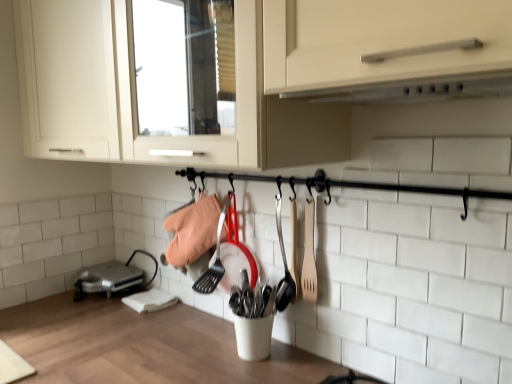
Describe the element at coordinates (284, 267) in the screenshot. I see `wooden spoon at center-right` at that location.

Measure the distance between wooden spoon at center-right and camera.

1.22 meters.

Locate an element on the screen. The width and height of the screenshot is (512, 384). white wood countertop at center is located at coordinates (142, 346).

Measure the distance between white wood countertop at center and camera.

white wood countertop at center and camera are 1.07 meters apart from each other.

Where is `white matte exhaust hood at upper center`? white matte exhaust hood at upper center is located at coordinates (414, 88).

The height and width of the screenshot is (384, 512). In order to click on wooden spoon at center-right in this screenshot , I will do `click(284, 267)`.

Considering the sizes of white matte exhaust hood at upper center and wooden spoon at center-right in the image, is white matte exhaust hood at upper center wider or thinner than wooden spoon at center-right?

In the image, white matte exhaust hood at upper center appears to be wider than wooden spoon at center-right.

Is wooden spoon at center-right a part of white matte exhaust hood at upper center?

No, wooden spoon at center-right is not surrounded by white matte exhaust hood at upper center.

Considering the relative sizes of white matte exhaust hood at upper center and wooden spoon at center-right in the image provided, is white matte exhaust hood at upper center taller than wooden spoon at center-right?

In fact, white matte exhaust hood at upper center may be shorter than wooden spoon at center-right.

In terms of height, does silver metallic toaster at lower left look taller or shorter compared to wooden spatula at center-right?

Considering their sizes, silver metallic toaster at lower left has less height than wooden spatula at center-right.

Is silver metallic toaster at lower left far from wooden spatula at center-right?

That's not correct — silver metallic toaster at lower left is a little close to wooden spatula at center-right.

How far apart are silver metallic toaster at lower left and wooden spatula at center-right?

The distance of silver metallic toaster at lower left from wooden spatula at center-right is 34.22 inches.

In the image, is silver metallic toaster at lower left on the left side or the right side of wooden spatula at center-right?

In the image, silver metallic toaster at lower left appears on the left side of wooden spatula at center-right.

Measure the distance from wooden spatula at center-right to silver metallic toaster at lower left.

A distance of 34.22 inches exists between wooden spatula at center-right and silver metallic toaster at lower left.

Is wooden spatula at center-right turned away from silver metallic toaster at lower left?

No, wooden spatula at center-right's orientation is not away from silver metallic toaster at lower left.

From the image's perspective, which object appears higher, wooden spatula at center-right or silver metallic toaster at lower left?

wooden spatula at center-right.

Considering the relative positions of wooden spatula at center-right and silver metallic toaster at lower left in the image provided, is wooden spatula at center-right to the left or to the right of silver metallic toaster at lower left?

wooden spatula at center-right is to the right of silver metallic toaster at lower left.

Considering the relative positions of wooden spoon at center-right and white matte exhaust hood at upper center in the image provided, is wooden spoon at center-right to the right of white matte exhaust hood at upper center from the viewer's perspective?

Incorrect, wooden spoon at center-right is not on the right side of white matte exhaust hood at upper center.

Is wooden spoon at center-right situated inside white matte exhaust hood at upper center or outside?

The correct answer is: outside.

Is point (288, 270) closer to viewer compared to point (411, 82)?

No.

Which of these two, white wood countertop at center or wooden spatula at center-right, stands taller?

With more height is white wood countertop at center.

From a real-world perspective, which object stands above the other?

wooden spatula at center-right.

Does white wood countertop at center appear on the left side of wooden spatula at center-right?

Indeed, white wood countertop at center is positioned on the left side of wooden spatula at center-right.

How different are the orientations of white wood countertop at center and wooden spatula at center-right in degrees?

The angle between the facing direction of white wood countertop at center and the facing direction of wooden spatula at center-right is 0.742 degrees.

Can you tell me how much silver metallic toaster at lower left and white wood countertop at center differ in facing direction?

The angle between the facing direction of silver metallic toaster at lower left and the facing direction of white wood countertop at center is 0.742 degrees.

Considering their positions, is silver metallic toaster at lower left located in front of or behind white wood countertop at center?

In the image, silver metallic toaster at lower left appears behind white wood countertop at center.

Image resolution: width=512 pixels, height=384 pixels. There is a white wood countertop at center. In order to click on home appliance above it (from a real-world perspective) in this screenshot , I will do `click(106, 279)`.

Can you confirm if white matte exhaust hood at upper center is taller than white wood countertop at center?

Incorrect, the height of white matte exhaust hood at upper center is not larger of that of white wood countertop at center.

Between point (452, 82) and point (123, 333), which one is positioned in front?

The point (452, 82) is closer to the camera.

Can you tell me how much white matte exhaust hood at upper center and white wood countertop at center differ in facing direction?

The angle between the facing direction of white matte exhaust hood at upper center and the facing direction of white wood countertop at center is 0.0943 degrees.

Choose the correct answer: Is white matte exhaust hood at upper center inside white wood countertop at center or outside it?

white matte exhaust hood at upper center cannot be found inside white wood countertop at center.

Locate an element on the screen. The image size is (512, 384). exhaust hood above the wooden spoon at center-right (from a real-world perspective) is located at coordinates (414, 88).

The height and width of the screenshot is (384, 512). In the image, there is a silver metallic toaster at lower left. What are the coordinates of `spatula above it (from the image's perspective)` in the screenshot? It's located at (309, 251).

Based on their spatial positions, is wooden spoon at center-right or wooden spatula at center-right closer to white matte exhaust hood at upper center?

Based on the image, wooden spatula at center-right appears to be nearer to white matte exhaust hood at upper center.

Looking at the image, which one is located further to silver metallic toaster at lower left, wooden spoon at center-right or white matte exhaust hood at upper center?

The object further to silver metallic toaster at lower left is white matte exhaust hood at upper center.

Which object lies further to the anchor point wooden spoon at center-right, white wood countertop at center or white matte exhaust hood at upper center?

white matte exhaust hood at upper center lies further to wooden spoon at center-right than the other object.

Which object lies further to the anchor point white matte exhaust hood at upper center, white wood countertop at center or wooden spatula at center-right?

Based on the image, white wood countertop at center appears to be further to white matte exhaust hood at upper center.

Estimate the real-world distances between objects in this image. Which object is closer to white matte exhaust hood at upper center, wooden spoon at center-right or silver metallic toaster at lower left?

wooden spoon at center-right is positioned closer to the anchor white matte exhaust hood at upper center.

Based on their spatial positions, is white matte exhaust hood at upper center or wooden spatula at center-right further from white wood countertop at center?

white matte exhaust hood at upper center lies further to white wood countertop at center than the other object.

Estimate the real-world distances between objects in this image. Which object is further from white matte exhaust hood at upper center, wooden spatula at center-right or wooden spoon at center-right?

wooden spoon at center-right lies further to white matte exhaust hood at upper center than the other object.

Estimate the real-world distances between objects in this image. Which object is further from silver metallic toaster at lower left, white matte exhaust hood at upper center or wooden spoon at center-right?

Among the two, white matte exhaust hood at upper center is located further to silver metallic toaster at lower left.

In order to click on shovel located between white matte exhaust hood at upper center and silver metallic toaster at lower left in the depth direction in this screenshot , I will do `click(284, 267)`.

The image size is (512, 384). I want to click on shovel between white matte exhaust hood at upper center and white wood countertop at center from top to bottom, so click(284, 267).

This screenshot has width=512, height=384. I want to click on countertop between white matte exhaust hood at upper center and silver metallic toaster at lower left from front to back, so click(142, 346).

This screenshot has width=512, height=384. I want to click on spatula between white wood countertop at center and silver metallic toaster at lower left along the z-axis, so click(309, 251).